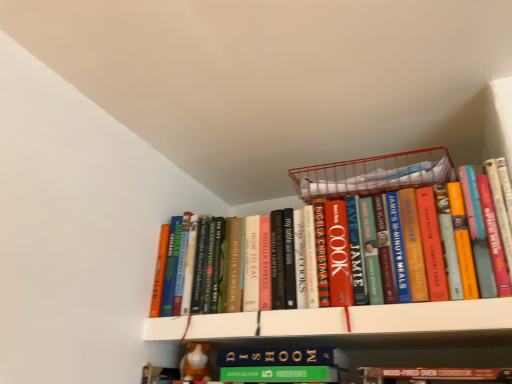
The image size is (512, 384). Identify the location of orange fabric dog at lower center. (196, 363).

What do you see at coordinates (433, 229) in the screenshot?
I see `hardcover books at center` at bounding box center [433, 229].

You are a GUI agent. You are given a task and a screenshot of the screen. Output one action in this format:
    pyautogui.click(x=<x>, y=<y>)
    Task: Click on the metallic wire basket at upper center
    
    Given the screenshot: What is the action you would take?
    pyautogui.click(x=373, y=174)

Considering the relative sizes of hardcover books at center and metallic wire basket at upper center in the image provided, is hardcover books at center taller than metallic wire basket at upper center?

Yes.

From the image's perspective, is hardcover books at center under metallic wire basket at upper center?

Yes, from the image's perspective, hardcover books at center is below metallic wire basket at upper center.

Is point (326, 261) farther from viewer compared to point (341, 182)?

No, it is in front of (341, 182).

Is orange fabric dog at lower center oriented away from white matte bookshelf at upper center?

No, orange fabric dog at lower center is not facing away from white matte bookshelf at upper center.

From the image's perspective, is orange fabric dog at lower center below white matte bookshelf at upper center?

Indeed, from the image's perspective, orange fabric dog at lower center is shown beneath white matte bookshelf at upper center.

Is orange fabric dog at lower center bigger than white matte bookshelf at upper center?

Incorrect, orange fabric dog at lower center is not larger than white matte bookshelf at upper center.

From a real-world perspective, is orange fabric dog at lower center above or below white matte bookshelf at upper center?

Clearly, from a real-world perspective, orange fabric dog at lower center is below white matte bookshelf at upper center.

Based on the photo, is orange fabric dog at lower center outside of metallic wire basket at upper center?

That's correct, orange fabric dog at lower center is outside of metallic wire basket at upper center.

Is orange fabric dog at lower center oriented away from metallic wire basket at upper center?

orange fabric dog at lower center does not have its back to metallic wire basket at upper center.

From the image's perspective, does orange fabric dog at lower center appear lower than metallic wire basket at upper center?

Indeed, from the image's perspective, orange fabric dog at lower center is shown beneath metallic wire basket at upper center.

Measure the distance between metallic wire basket at upper center and orange fabric dog at lower center.

A distance of 23.26 inches exists between metallic wire basket at upper center and orange fabric dog at lower center.

From a real-world perspective, is metallic wire basket at upper center located beneath orange fabric dog at lower center?

Incorrect, from a real-world perspective, metallic wire basket at upper center is higher than orange fabric dog at lower center.

Is metallic wire basket at upper center oriented towards orange fabric dog at lower center?

No.

Can we say metallic wire basket at upper center lies outside orange fabric dog at lower center?

Absolutely, metallic wire basket at upper center is external to orange fabric dog at lower center.

From the image's perspective, would you say metallic wire basket at upper center is shown under hardcover books at center?

Actually, metallic wire basket at upper center appears above hardcover books at center in the image.

Is point (350, 176) positioned in front of point (318, 302)?

No, (350, 176) is further to viewer.

Is metallic wire basket at upper center positioned beyond the bounds of hardcover books at center?

Indeed, metallic wire basket at upper center is completely outside hardcover books at center.

From a real-world perspective, between metallic wire basket at upper center and hardcover books at center, who is vertically higher?

From a 3D spatial view, metallic wire basket at upper center is above.

This screenshot has height=384, width=512. In order to click on basket above the white matte bookshelf at upper center (from a real-world perspective) in this screenshot , I will do `click(373, 174)`.

From the image's perspective, between white matte bookshelf at upper center and metallic wire basket at upper center, which one is located above?

From the image's view, metallic wire basket at upper center is above.

How much distance is there between white matte bookshelf at upper center and metallic wire basket at upper center?

31.67 centimeters.

Which of these two, white matte bookshelf at upper center or metallic wire basket at upper center, is thinner?

With smaller width is metallic wire basket at upper center.

Does white matte bookshelf at upper center appear on the left side of hardcover books at center?

No, white matte bookshelf at upper center is not to the left of hardcover books at center.

Consider the image. Is white matte bookshelf at upper center closer to camera compared to hardcover books at center?

Yes, the depth of white matte bookshelf at upper center is less than that of hardcover books at center.

Can you confirm if white matte bookshelf at upper center is thinner than hardcover books at center?

Incorrect, the width of white matte bookshelf at upper center is not less than that of hardcover books at center.

Is point (388, 310) positioned after point (395, 238)?

No, it is in front of (395, 238).

The height and width of the screenshot is (384, 512). In order to click on book below the metallic wire basket at upper center (from a real-world perspective) in this screenshot , I will do [x=433, y=229].

Where is `toy lying below the white matte bookshelf at upper center (from the image's perspective)`? This screenshot has width=512, height=384. toy lying below the white matte bookshelf at upper center (from the image's perspective) is located at coordinates (196, 363).

Considering their positions, is white matte bookshelf at upper center positioned further to orange fabric dog at lower center than metallic wire basket at upper center?

The object further to orange fabric dog at lower center is metallic wire basket at upper center.

Which object lies further to the anchor point hardcover books at center, metallic wire basket at upper center or orange fabric dog at lower center?

Among the two, orange fabric dog at lower center is located further to hardcover books at center.

Looking at the image, which one is located closer to hardcover books at center, white matte bookshelf at upper center or metallic wire basket at upper center?

metallic wire basket at upper center is closer to hardcover books at center.

Based on their spatial positions, is white matte bookshelf at upper center or hardcover books at center closer to metallic wire basket at upper center?

hardcover books at center lies closer to metallic wire basket at upper center than the other object.

Considering their positions, is metallic wire basket at upper center positioned further to white matte bookshelf at upper center than hardcover books at center?

Based on the image, metallic wire basket at upper center appears to be further to white matte bookshelf at upper center.

Looking at the image, which one is located closer to white matte bookshelf at upper center, orange fabric dog at lower center or hardcover books at center?

Based on the image, hardcover books at center appears to be nearer to white matte bookshelf at upper center.

Estimate the real-world distances between objects in this image. Which object is further from orange fabric dog at lower center, metallic wire basket at upper center or white matte bookshelf at upper center?

The object further to orange fabric dog at lower center is metallic wire basket at upper center.

Based on their spatial positions, is white matte bookshelf at upper center or orange fabric dog at lower center closer to hardcover books at center?

white matte bookshelf at upper center.

The image size is (512, 384). What are the coordinates of `book situated between orange fabric dog at lower center and metallic wire basket at upper center from left to right` in the screenshot? It's located at (433, 229).

Locate an element on the screen. book between metallic wire basket at upper center and white matte bookshelf at upper center vertically is located at coordinates (433, 229).

The height and width of the screenshot is (384, 512). What are the coordinates of `shelf between metallic wire basket at upper center and orange fabric dog at lower center vertically` in the screenshot? It's located at (390, 319).

This screenshot has height=384, width=512. I want to click on book located between orange fabric dog at lower center and white matte bookshelf at upper center in the left-right direction, so click(433, 229).